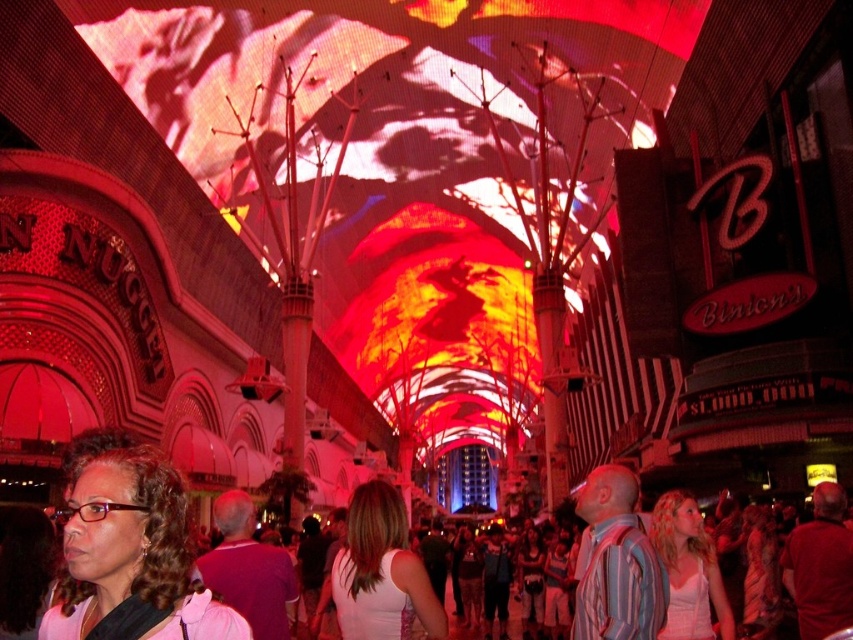
You are at a lively urban area with a red and orange light display above. You see a white satin dress at lower right. Where exactly is the white satin dress located in the scene?

The white satin dress at lower right is located at point (x=689, y=570).

You are a photographer trying to capture both the matte pink shirt at lower left and the striped cotton shirt at center in a single frame. Since the camera has a limited focus range, which shirt should you focus on first to ensure it appears clearer in the photo?

The matte pink shirt at lower left should be focused on first because it is larger in size than the striped cotton shirt at center, making it more prominent and likely requiring clearer focus.

You are a photographer positioned in the crowd and want to capture both the white satin dress at lower right and the matte white tank top at center in a single shot. Which clothing item will appear larger in your photo?

The white satin dress at lower right will appear larger in the photo because it is closer to the viewer than the matte white tank top at center.